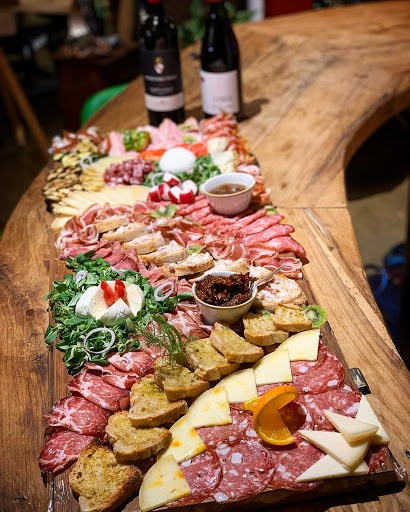
Find the location of a particular element. Image resolution: width=410 pixels, height=512 pixels. dipping bowl is located at coordinates (230, 200), (228, 312), (215, 198), (212, 183), (206, 308).